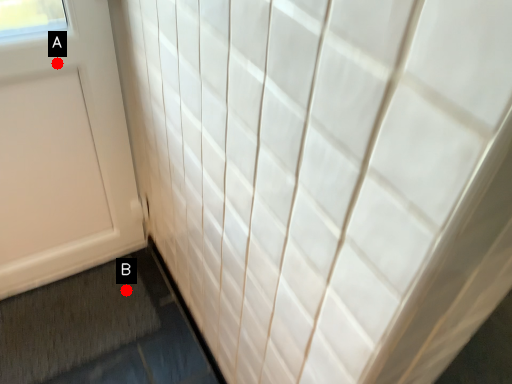
Question: Two points are circled on the image, labeled by A and B beside each circle. Which point is closer to the camera?

Choices:
 (A) A is closer
 (B) B is closer

Answer: (A)